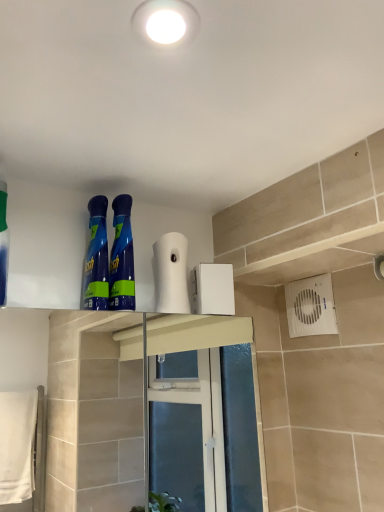
Question: Is white matte toilet paper at upper center surrounding green matte bottle at left, the first cleaning product viewed from the left?

Choices:
 (A) no
 (B) yes

Answer: (A)

Question: Are white matte toilet paper at upper center and green matte bottle at left, the first cleaning product viewed from the left, located far from each other?

Choices:
 (A) no
 (B) yes

Answer: (A)

Question: Does white matte toilet paper at upper center have a greater width compared to green matte bottle at left, acting as the third cleaning product starting from the right?

Choices:
 (A) yes
 (B) no

Answer: (B)

Question: Is green matte bottle at left, the first cleaning product viewed from the left, at the back of white matte toilet paper at upper center?

Choices:
 (A) no
 (B) yes

Answer: (A)

Question: Are white matte toilet paper at upper center and green matte bottle at left, the first cleaning product viewed from the left, beside each other?

Choices:
 (A) no
 (B) yes

Answer: (A)

Question: From their relative heights in the image, would you say white matte toilet paper at upper center is taller or shorter than blue glossy bottle at upper left, arranged as the second cleaning product when viewed from the left?

Choices:
 (A) tall
 (B) short

Answer: (B)

Question: In the image, is white matte toilet paper at upper center positioned in front of or behind blue glossy bottle at upper left, arranged as the second cleaning product when viewed from the left?

Choices:
 (A) front
 (B) behind

Answer: (B)

Question: Do you think white matte toilet paper at upper center is within blue glossy bottle at upper left, arranged as the second cleaning product when viewed from the left, or outside of it?

Choices:
 (A) outside
 (B) inside

Answer: (A)

Question: Considering the positions of white matte toilet paper at upper center and blue glossy bottle at upper left, arranged as the second cleaning product when viewed from the left, in the image, is white matte toilet paper at upper center wider or thinner than blue glossy bottle at upper left, arranged as the second cleaning product when viewed from the left,?

Choices:
 (A) wide
 (B) thin

Answer: (B)

Question: In terms of width, does green matte bottle at left, the first cleaning product viewed from the left, look wider or thinner when compared to blue glossy spray bottles at center, the first cleaning product in the right-to-left sequence?

Choices:
 (A) wide
 (B) thin

Answer: (A)

Question: From their relative heights in the image, would you say green matte bottle at left, the first cleaning product viewed from the left, is taller or shorter than blue glossy spray bottles at center, the third cleaning product positioned from the left?

Choices:
 (A) tall
 (B) short

Answer: (A)

Question: From a real-world perspective, relative to blue glossy spray bottles at center, the first cleaning product in the right-to-left sequence, is green matte bottle at left, acting as the third cleaning product starting from the right, vertically above or below?

Choices:
 (A) above
 (B) below

Answer: (A)

Question: From the image's perspective, is green matte bottle at left, the first cleaning product viewed from the left, positioned above or below blue glossy spray bottles at center, the third cleaning product positioned from the left?

Choices:
 (A) above
 (B) below

Answer: (A)

Question: Does point (117, 241) appear closer or farther from the camera than point (99, 259)?

Choices:
 (A) farther
 (B) closer

Answer: (A)

Question: From the image's perspective, is blue glossy spray bottles at center, the first cleaning product in the right-to-left sequence, positioned above or below blue glossy bottle at upper left, arranged as the second cleaning product when viewed from the left?

Choices:
 (A) below
 (B) above

Answer: (B)